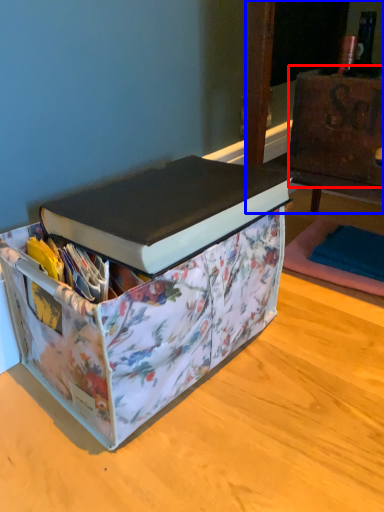
Question: Which object is further to the camera taking this photo, cardboard box (highlighted by a red box) or furniture (highlighted by a blue box)?

Choices:
 (A) cardboard box
 (B) furniture

Answer: (A)